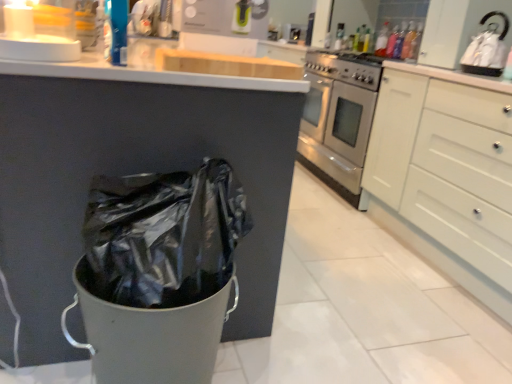
Question: Can you confirm if matte white sink at upper center is bigger than translucent plastic bottle at upper right, the second bottle positioned from the back?

Choices:
 (A) no
 (B) yes

Answer: (B)

Question: Can you confirm if matte white sink at upper center is positioned to the right of translucent plastic bottle at upper right, the first bottle viewed from the right?

Choices:
 (A) no
 (B) yes

Answer: (A)

Question: From the image's perspective, would you say matte white sink at upper center is positioned over translucent plastic bottle at upper right, acting as the 2th bottle starting from the left?

Choices:
 (A) yes
 (B) no

Answer: (A)

Question: Could you tell me if matte white sink at upper center is turned towards translucent plastic bottle at upper right, the first bottle positioned from the front?

Choices:
 (A) no
 (B) yes

Answer: (B)

Question: Considering the relative sizes of matte white sink at upper center and translucent plastic bottle at upper right, acting as the 2th bottle starting from the left, in the image provided, is matte white sink at upper center taller than translucent plastic bottle at upper right, acting as the 2th bottle starting from the left,?

Choices:
 (A) no
 (B) yes

Answer: (A)

Question: Is matte white sink at upper center positioned behind translucent plastic bottle at upper right, acting as the 2th bottle starting from the left?

Choices:
 (A) no
 (B) yes

Answer: (B)

Question: Is white matte cabinet at right beside translucent plastic bottle at upper right, which ranks as the second bottle in right-to-left order?

Choices:
 (A) yes
 (B) no

Answer: (B)

Question: Considering the relative positions of white matte cabinet at right and translucent plastic bottle at upper right, which is counted as the second bottle, starting from the front, in the image provided, is white matte cabinet at right behind translucent plastic bottle at upper right, which is counted as the second bottle, starting from the front,?

Choices:
 (A) yes
 (B) no

Answer: (B)

Question: Can you confirm if white matte cabinet at right is positioned to the right of translucent plastic bottle at upper right, which ranks as the second bottle in right-to-left order?

Choices:
 (A) yes
 (B) no

Answer: (A)

Question: Can you confirm if white matte cabinet at right is bigger than translucent plastic bottle at upper right, positioned as the 1th bottle in back-to-front order?

Choices:
 (A) no
 (B) yes

Answer: (B)

Question: Can we say white matte cabinet at right lies outside translucent plastic bottle at upper right, which is counted as the second bottle, starting from the front?

Choices:
 (A) no
 (B) yes

Answer: (B)

Question: Does white matte cabinet at right lie in front of translucent plastic bottle at upper right, positioned as the 1th bottle in back-to-front order?

Choices:
 (A) no
 (B) yes

Answer: (B)

Question: From a real-world perspective, is white matte cabinet at right positioned under white glossy kettle at upper right based on gravity?

Choices:
 (A) no
 (B) yes

Answer: (B)